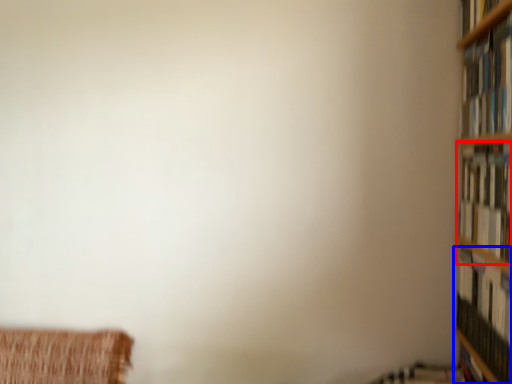
Question: Which point is closer to the camera, book (highlighted by a red box) or book (highlighted by a blue box)?

Choices:
 (A) book
 (B) book

Answer: (A)